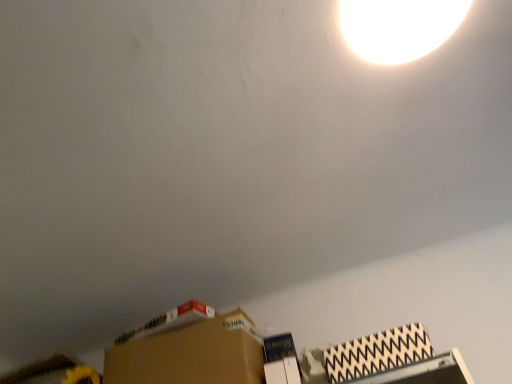
Question: Could brown cardboard box at lower center, marked as the second cardboard box in a right-to-left arrangement, be considered to be inside patterned cardboard box at lower right, the 1th cardboard box from the right?

Choices:
 (A) yes
 (B) no

Answer: (B)

Question: Is patterned cardboard box at lower right, the 1th cardboard box from the right, looking in the opposite direction of brown cardboard box at lower center, placed as the first cardboard box when sorted from back to front?

Choices:
 (A) no
 (B) yes

Answer: (A)

Question: Considering the relative sizes of patterned cardboard box at lower right, positioned as the 2th cardboard box in back-to-front order, and brown cardboard box at lower center, arranged as the second cardboard box when viewed from the front, in the image provided, is patterned cardboard box at lower right, positioned as the 2th cardboard box in back-to-front order, wider than brown cardboard box at lower center, arranged as the second cardboard box when viewed from the front,?

Choices:
 (A) yes
 (B) no

Answer: (B)

Question: Can you confirm if patterned cardboard box at lower right, positioned as the 2th cardboard box in back-to-front order, is positioned to the left of brown cardboard box at lower center, placed as the first cardboard box when sorted from back to front?

Choices:
 (A) no
 (B) yes

Answer: (A)

Question: Can you confirm if patterned cardboard box at lower right, the 1th cardboard box from the right, is thinner than brown cardboard box at lower center, placed as the first cardboard box when sorted from back to front?

Choices:
 (A) yes
 (B) no

Answer: (A)

Question: Considering the relative sizes of patterned cardboard box at lower right, the 1th cardboard box from the right, and brown cardboard box at lower center, marked as the second cardboard box in a right-to-left arrangement, in the image provided, is patterned cardboard box at lower right, the 1th cardboard box from the right, taller than brown cardboard box at lower center, marked as the second cardboard box in a right-to-left arrangement,?

Choices:
 (A) no
 (B) yes

Answer: (A)

Question: Does brown cardboard box at lower center, marked as the second cardboard box in a right-to-left arrangement, have a smaller size compared to white glossy lampshade at upper center?

Choices:
 (A) yes
 (B) no

Answer: (B)

Question: Can you confirm if brown cardboard box at lower center, arranged as the second cardboard box when viewed from the front, is positioned to the right of white glossy lampshade at upper center?

Choices:
 (A) no
 (B) yes

Answer: (A)

Question: Would you say white glossy lampshade at upper center is part of brown cardboard box at lower center, arranged as the second cardboard box when viewed from the front,'s contents?

Choices:
 (A) yes
 (B) no

Answer: (B)

Question: Considering the relative positions of brown cardboard box at lower center, arranged as the second cardboard box when viewed from the front, and white glossy lampshade at upper center in the image provided, is brown cardboard box at lower center, arranged as the second cardboard box when viewed from the front, in front of white glossy lampshade at upper center?

Choices:
 (A) yes
 (B) no

Answer: (B)

Question: Does brown cardboard box at lower center, the 1th cardboard box in the left-to-right sequence, appear on the left side of white glossy lampshade at upper center?

Choices:
 (A) no
 (B) yes

Answer: (B)

Question: Does brown cardboard box at lower center, the 1th cardboard box in the left-to-right sequence, have a lesser height compared to white glossy lampshade at upper center?

Choices:
 (A) no
 (B) yes

Answer: (A)

Question: Is white glossy lampshade at upper center thinner than patterned cardboard box at lower right, the 1th cardboard box from the right?

Choices:
 (A) yes
 (B) no

Answer: (B)